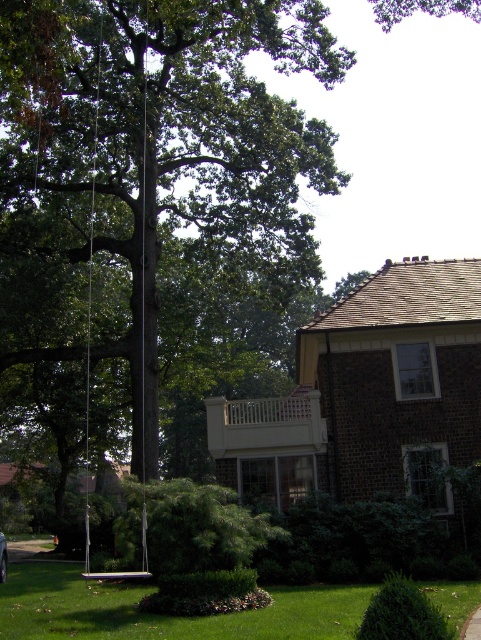
You are standing at point (163, 616) in the suburban scene. What is located at this point?

The point (163, 616) is where the green grass at lower center is located.

You are standing at the base of the large, mature tree in the suburban scene and want to walk towards the green grass at lower center. How far will you have to walk to reach it?

The green grass at lower center is 28.11 feet from the viewer, so you will have to walk approximately 28.11 feet to reach it.